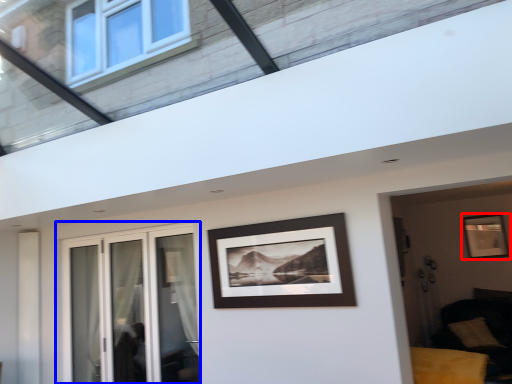
Question: Which point is closer to the camera, picture frame (highlighted by a red box) or window (highlighted by a blue box)?

Choices:
 (A) picture frame
 (B) window

Answer: (B)